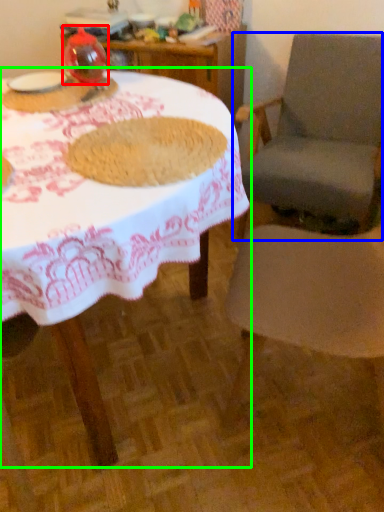
Question: Which is nearer to the tableware (highlighted by a red box)? chair (highlighted by a blue box) or table (highlighted by a green box).

Choices:
 (A) chair
 (B) table

Answer: (B)